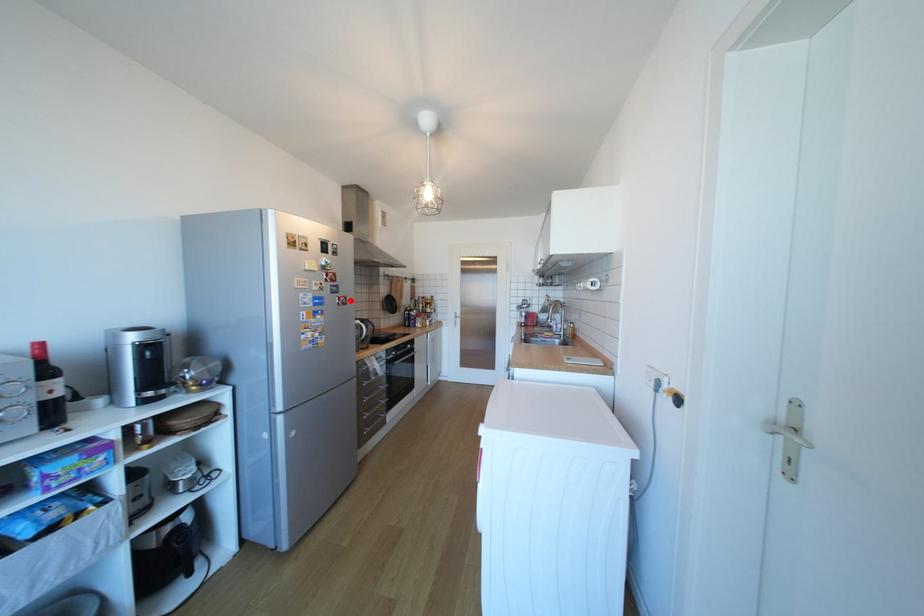
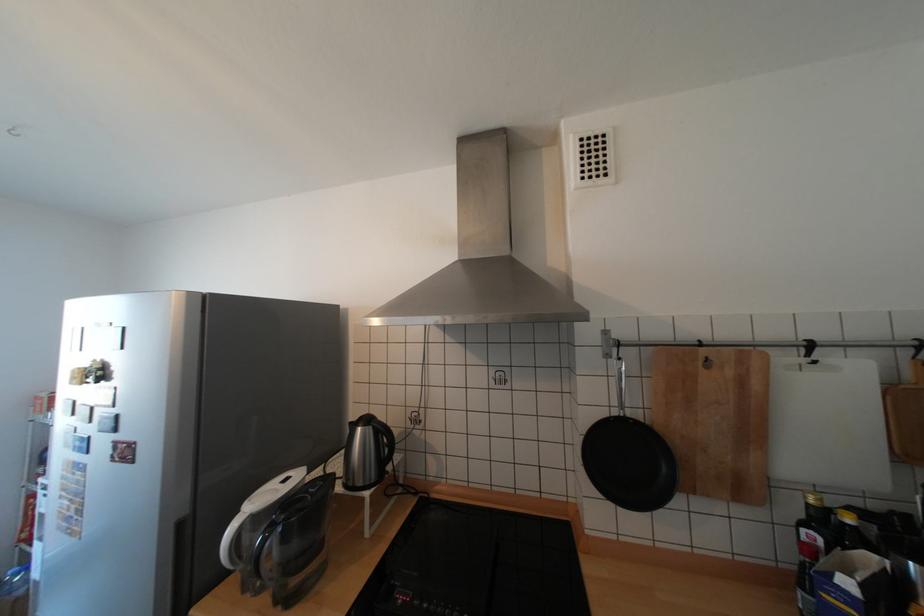
Locate, in the second image, the point that corresponds to the highlighted location in the first image.

(128, 451)